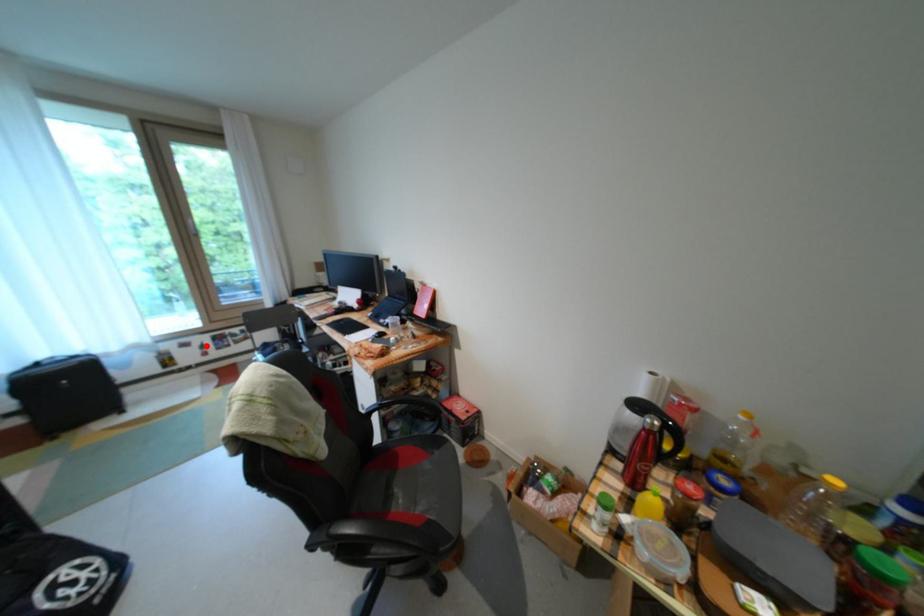
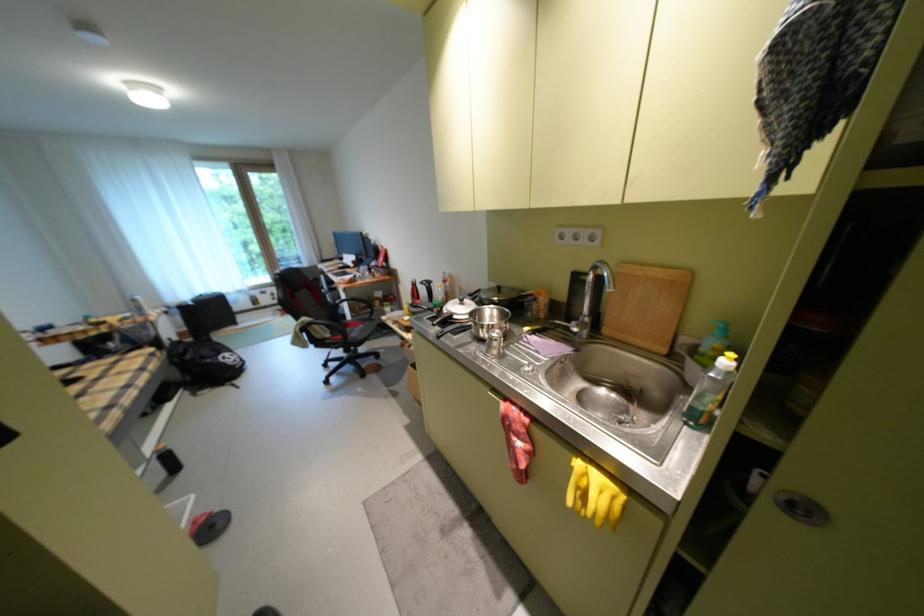
In the second image, find the point that corresponds to the highlighted location in the first image.

(280, 294)